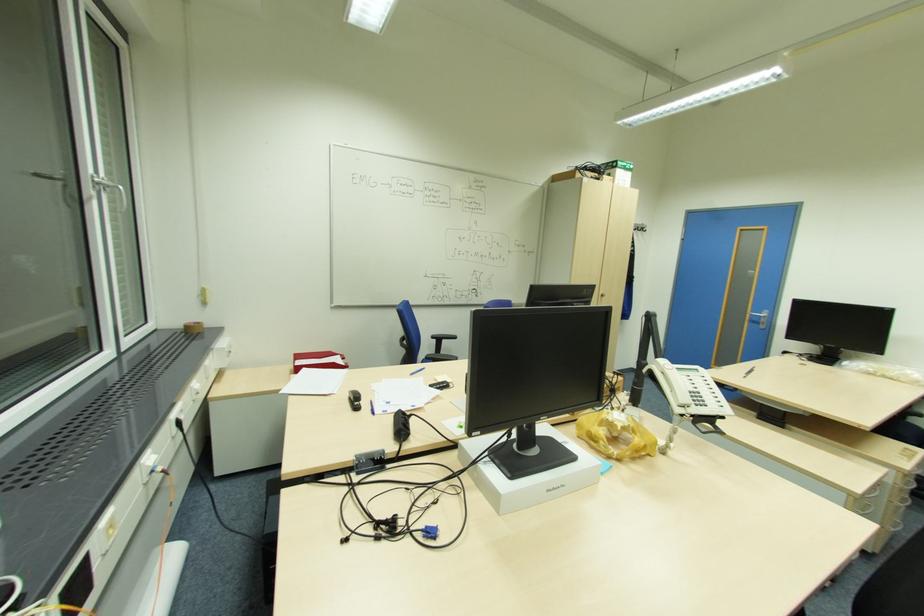
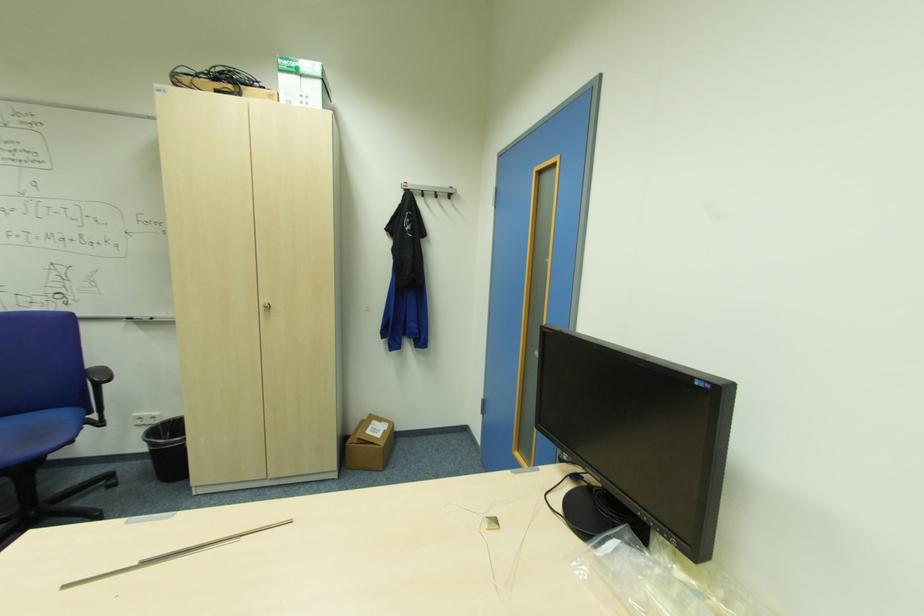
Find the pixel in the second image that matches the point at 747,377 in the first image.

(63, 589)